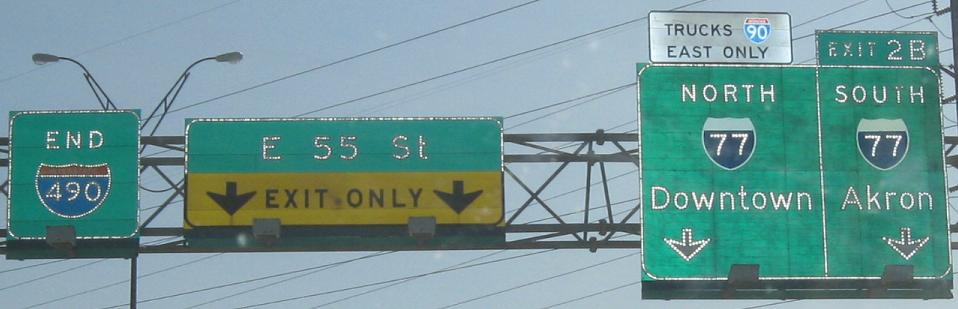
You are a GUI agent. You are given a task and a screenshot of the screen. Output one action in this format:
    pyautogui.click(x=<x>, y=<y>)
    Task: Click on the lights
    The width and height of the screenshot is (958, 309).
    Given the screenshot: What is the action you would take?
    pyautogui.click(x=225, y=57), pyautogui.click(x=44, y=58)